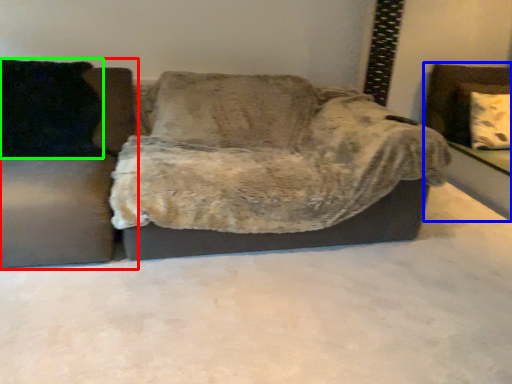
Question: Which object is positioned closest to studio couch (highlighted by a red box)? Select from swivel chair (highlighted by a blue box) and pillow (highlighted by a green box).

Choices:
 (A) swivel chair
 (B) pillow

Answer: (B)